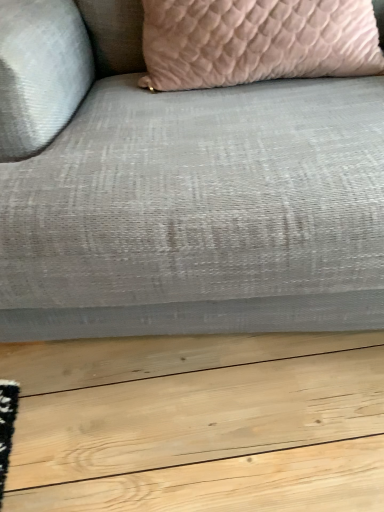
Question: From the image's perspective, is textured gray fabric couch at center located above or below pink textured pillow at upper center?

Choices:
 (A) below
 (B) above

Answer: (A)

Question: Considering the positions of textured gray fabric couch at center and pink textured pillow at upper center in the image, is textured gray fabric couch at center bigger or smaller than pink textured pillow at upper center?

Choices:
 (A) big
 (B) small

Answer: (A)

Question: Looking at their shapes, would you say textured gray fabric couch at center is wider or thinner than pink textured pillow at upper center?

Choices:
 (A) wide
 (B) thin

Answer: (A)

Question: Is pink textured pillow at upper center bigger or smaller than textured gray fabric couch at center?

Choices:
 (A) big
 (B) small

Answer: (B)

Question: From the image's perspective, is pink textured pillow at upper center located above or below textured gray fabric couch at center?

Choices:
 (A) above
 (B) below

Answer: (A)

Question: Is point (192, 10) positioned closer to the camera than point (271, 177)?

Choices:
 (A) farther
 (B) closer

Answer: (A)

Question: Based on their positions, is pink textured pillow at upper center located to the left or right of textured gray fabric couch at center?

Choices:
 (A) left
 (B) right

Answer: (B)